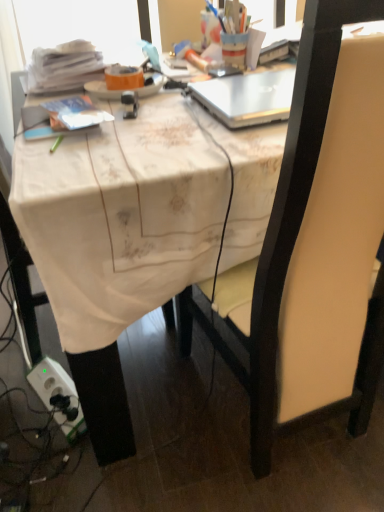
The image size is (384, 512). In order to click on space that is in front of orange matte plate at upper center in this screenshot , I will do click(x=153, y=114).